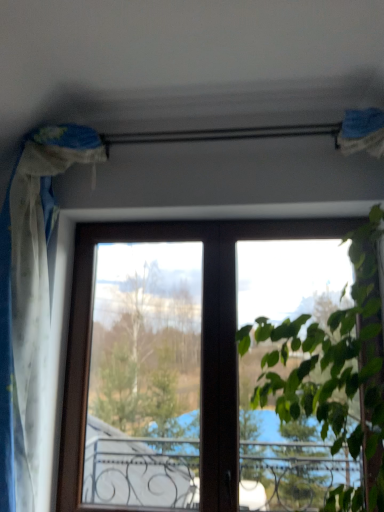
The image size is (384, 512). Describe the element at coordinates (309, 371) in the screenshot. I see `green leafy plant at upper right` at that location.

At what (x,y) coordinates should I click in order to perform the action: click on green leafy plant at upper right. Please return your answer as a coordinate pair (x, y). This screenshot has width=384, height=512. Looking at the image, I should click on (309, 371).

The image size is (384, 512). What do you see at coordinates (29, 295) in the screenshot?
I see `white sheer curtain at left` at bounding box center [29, 295].

Locate an element on the screen. The image size is (384, 512). white sheer curtain at left is located at coordinates (29, 295).

What are the coordinates of `green leafy plant at upper right` in the screenshot? It's located at (309, 371).

Which object is positioned more to the left, white sheer curtain at left or green leafy plant at upper right?

From the viewer's perspective, white sheer curtain at left appears more on the left side.

Is the depth of white sheer curtain at left less than that of green leafy plant at upper right?

No, white sheer curtain at left is further to the viewer.

Which point is more distant from viewer, (7, 447) or (364, 327)?

The point (7, 447) is more distant.

From the image's perspective, between white sheer curtain at left and green leafy plant at upper right, who is located below?

green leafy plant at upper right, from the image's perspective.

From a real-world perspective, is white sheer curtain at left physically below green leafy plant at upper right?

No, from a real-world perspective, white sheer curtain at left is not below green leafy plant at upper right.

In the scene shown: Which object is thinner, white sheer curtain at left or green leafy plant at upper right?

white sheer curtain at left is thinner.

Is white sheer curtain at left taller than green leafy plant at upper right?

Correct, white sheer curtain at left is much taller as green leafy plant at upper right.

Considering the relative sizes of white sheer curtain at left and green leafy plant at upper right in the image provided, is white sheer curtain at left bigger than green leafy plant at upper right?

No, white sheer curtain at left is not bigger than green leafy plant at upper right.

Is white sheer curtain at left located outside green leafy plant at upper right?

That's correct, white sheer curtain at left is outside of green leafy plant at upper right.

Is white sheer curtain at left far away from green leafy plant at upper right?

Yes, white sheer curtain at left and green leafy plant at upper right are quite far apart.

Is white sheer curtain at left oriented towards green leafy plant at upper right?

No.

Can you tell me how much white sheer curtain at left and green leafy plant at upper right differ in facing direction?

The angle between the facing direction of white sheer curtain at left and the facing direction of green leafy plant at upper right is 1.51 degrees.

Locate an element on the screen. This screenshot has height=512, width=384. vegetation that is in front of the white sheer curtain at left is located at coordinates (309, 371).

Considering the positions of objects green leafy plant at upper right and white sheer curtain at left in the image provided, who is more to the right, green leafy plant at upper right or white sheer curtain at left?

green leafy plant at upper right.

Considering their positions, is green leafy plant at upper right located in front of or behind white sheer curtain at left?

green leafy plant at upper right is in front of white sheer curtain at left.

Does point (286, 476) come closer to viewer compared to point (6, 473)?

That is False.

From the image's perspective, who appears lower, green leafy plant at upper right or white sheer curtain at left?

From the image's view, green leafy plant at upper right is below.

From a real-world perspective, which object rests below the other?

In real-world perspective, green leafy plant at upper right is lower.

Considering the sizes of objects green leafy plant at upper right and white sheer curtain at left in the image provided, who is thinner, green leafy plant at upper right or white sheer curtain at left?

Thinner between the two is white sheer curtain at left.

Does green leafy plant at upper right have a greater height compared to white sheer curtain at left?

No, green leafy plant at upper right is not taller than white sheer curtain at left.

Is green leafy plant at upper right bigger or smaller than white sheer curtain at left?

Considering their sizes, green leafy plant at upper right takes up more space than white sheer curtain at left.

Is green leafy plant at upper right surrounding white sheer curtain at left?

No, white sheer curtain at left is not inside green leafy plant at upper right.

Is green leafy plant at upper right not near white sheer curtain at left?

Indeed, green leafy plant at upper right is not near white sheer curtain at left.

Could you tell me if green leafy plant at upper right is facing white sheer curtain at left?

No, green leafy plant at upper right is not aimed at white sheer curtain at left.

Can you tell me how much green leafy plant at upper right and white sheer curtain at left differ in facing direction?

The angle between the facing direction of green leafy plant at upper right and the facing direction of white sheer curtain at left is 1.51 degrees.

At what (x,y) coordinates should I click in order to perform the action: click on vegetation on the right side of white sheer curtain at left. Please return your answer as a coordinate pair (x, y). The height and width of the screenshot is (512, 384). Looking at the image, I should click on (309, 371).

Where is `curtain behind the green leafy plant at upper right`? This screenshot has height=512, width=384. curtain behind the green leafy plant at upper right is located at coordinates (29, 295).

Find the location of a particular element. This screenshot has height=512, width=384. vegetation below the white sheer curtain at left (from the image's perspective) is located at coordinates (309, 371).